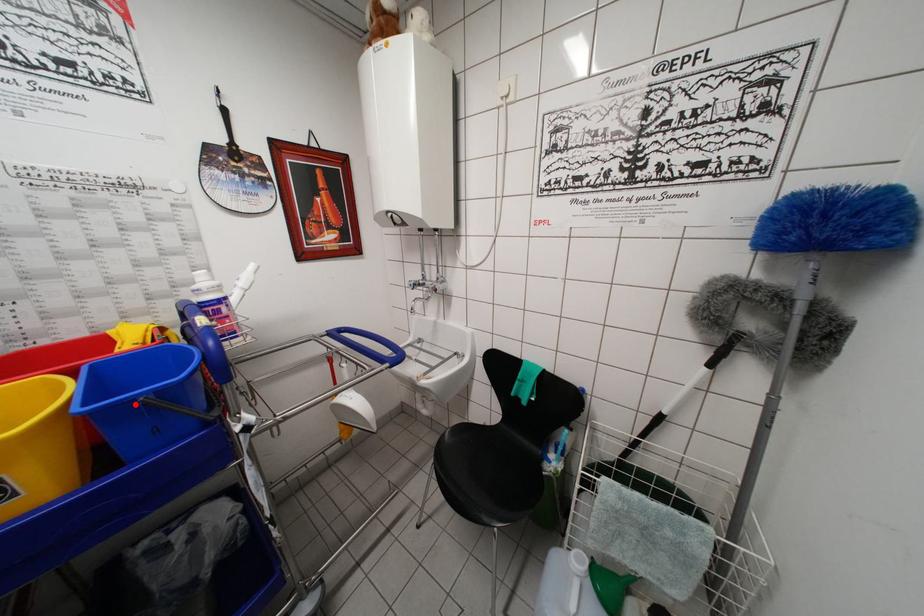
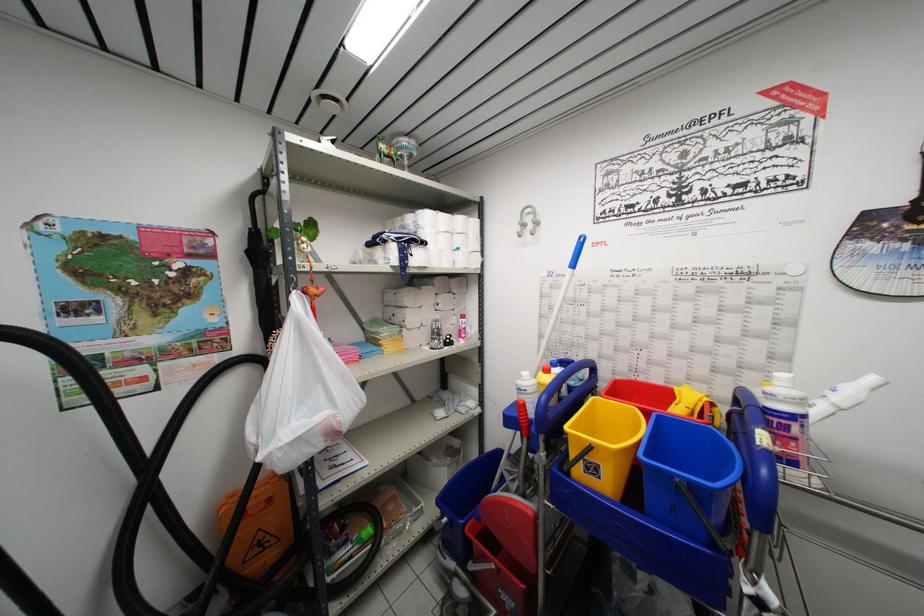
The point at the highlighted location is marked in the first image. Where is the corresponding point in the second image?

(675, 479)